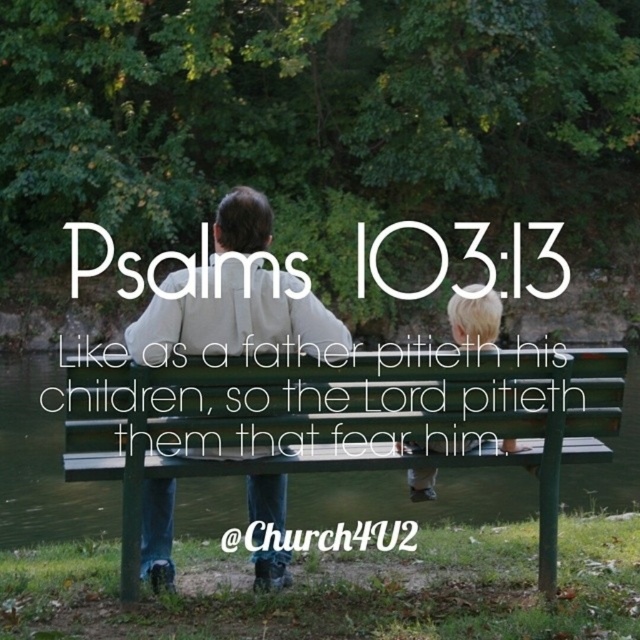
Is white matte shirt at center closer to the viewer compared to blonde hair at center?

No, it is behind blonde hair at center.

Is white matte shirt at center above blonde hair at center?

Incorrect, white matte shirt at center is not positioned above blonde hair at center.

The height and width of the screenshot is (640, 640). What are the coordinates of `white matte shirt at center` in the screenshot? It's located at (236, 317).

Who is more distant from viewer, (598, 365) or (483, 337)?

The point (483, 337) is behind.

At what (x,y) coordinates should I click in order to perform the action: click on green wooden bench at center. Please return your answer as a coordinate pair (x, y). The height and width of the screenshot is (640, 640). Looking at the image, I should click on (336, 419).

Image resolution: width=640 pixels, height=640 pixels. I want to click on green wooden bench at center, so (336, 419).

Is green wooden bench at center bigger than white matte shirt at center?

Yes.

Does green wooden bench at center have a greater width compared to white matte shirt at center?

Yes.

Consider the image. Who is more distant from viewer, (500, 422) or (227, 237)?

Point (500, 422)

The image size is (640, 640). Identify the location of green wooden bench at center. (336, 419).